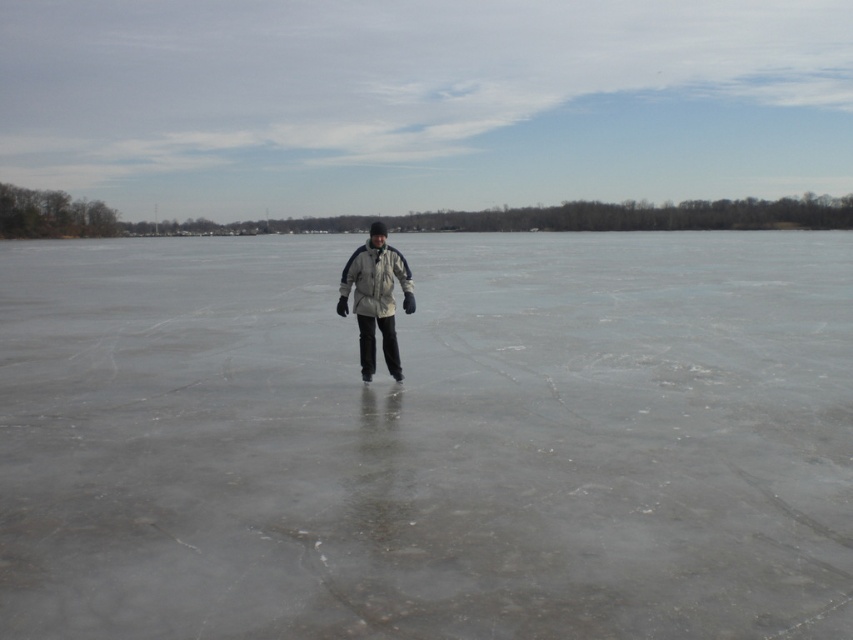
Does point (236, 611) lie in front of point (369, 253)?

That is True.

Is transparent ice at center to the left of white matte jacket at center from the viewer's perspective?

In fact, transparent ice at center is to the right of white matte jacket at center.

Describe the element at coordinates (428, 440) in the screenshot. Image resolution: width=853 pixels, height=640 pixels. I see `transparent ice at center` at that location.

Locate an element on the screen. transparent ice at center is located at coordinates (428, 440).